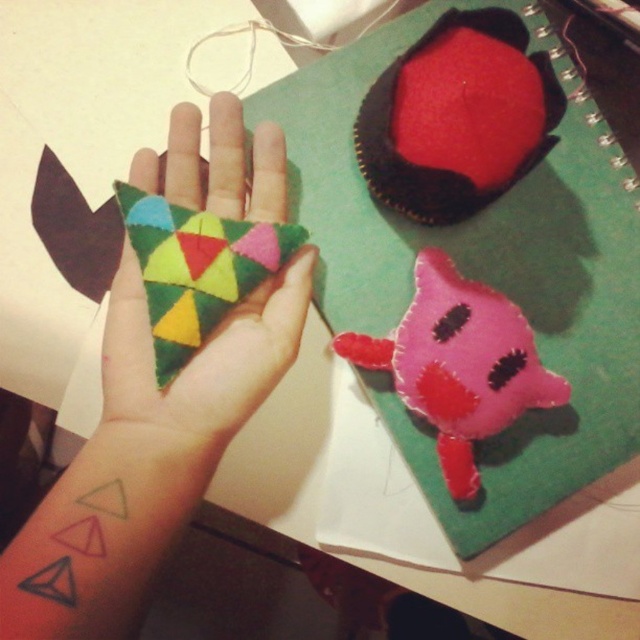
Question: Estimate the real-world distances between objects in this image. Which object is farther from the pink felt plushie at center?

Choices:
 (A) felt triangle at center
 (B) multicolored felt triangle at center

Answer: (A)

Question: Which point appears farthest from the camera in this image?

Choices:
 (A) (156, 440)
 (B) (349, 353)
 (C) (262, 378)

Answer: (B)

Question: Which object is closer to the camera taking this photo?

Choices:
 (A) pink felt plushie at center
 (B) multicolored felt triangle at center

Answer: (B)

Question: Is felt triangle at center behind pink felt plushie at center?

Choices:
 (A) yes
 (B) no

Answer: (B)

Question: Can you confirm if felt triangle at center is positioned below pink felt plushie at center?

Choices:
 (A) yes
 (B) no

Answer: (B)

Question: Does multicolored felt triangle at center have a greater width compared to pink felt plushie at center?

Choices:
 (A) no
 (B) yes

Answer: (A)